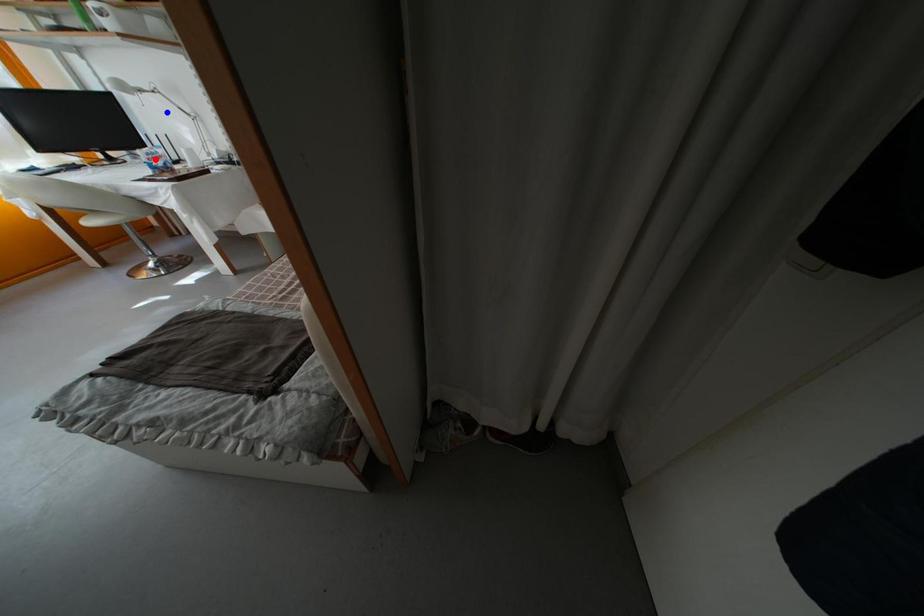
Question: Two points are marked on the image. Which point is closer to the camera?

Choices:
 (A) Blue point is closer.
 (B) Red point is closer.

Answer: (A)